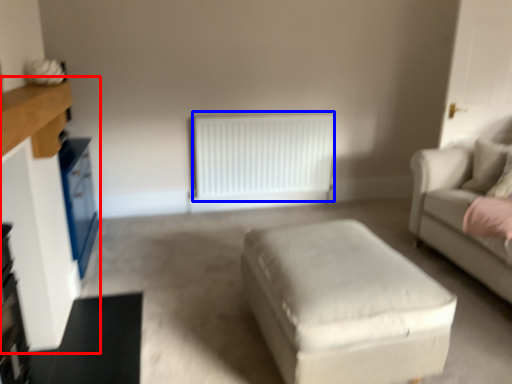
Question: Among these objects, which one is nearest to the camera, entertainment center (highlighted by a red box) or radiator (highlighted by a blue box)?

Choices:
 (A) entertainment center
 (B) radiator

Answer: (A)